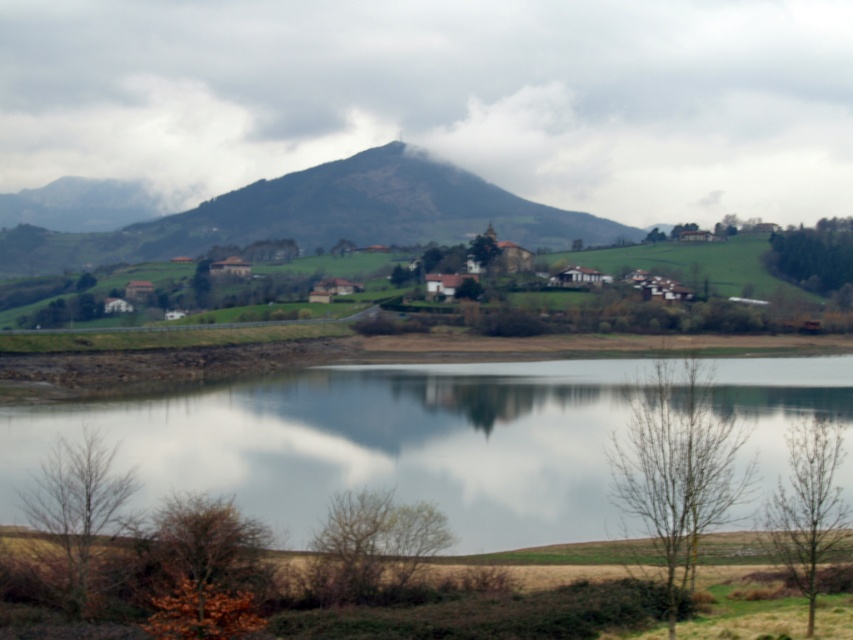
Based on the photo, you are standing at the point closer to the camera between the two points, point (497,413) and point (83,456). Which point are you standing at?

You are standing at point (497,413) because it is further to the camera than point (83,456).

You are standing at the edge of the serene landscape and want to locate the transparent water at center. According to the coordinates provided, in which direction should you look to find it?

You should look towards the center of the image, as the transparent water at center is located at point (370, 445), which corresponds to the central area.